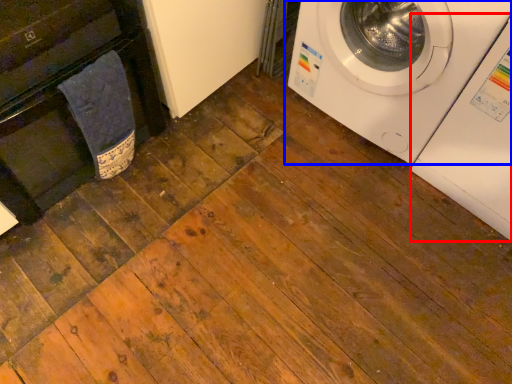
Question: Among these objects, which one is nearest to the camera, washing machine (highlighted by a red box) or washing machine (highlighted by a blue box)?

Choices:
 (A) washing machine
 (B) washing machine

Answer: (A)